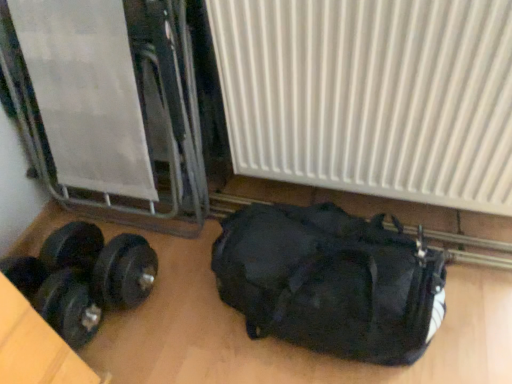
Find the location of a particular element. The image size is (512, 384). vacant space in white ribbed radiator at center (from a real-world perspective) is located at coordinates (393, 215).